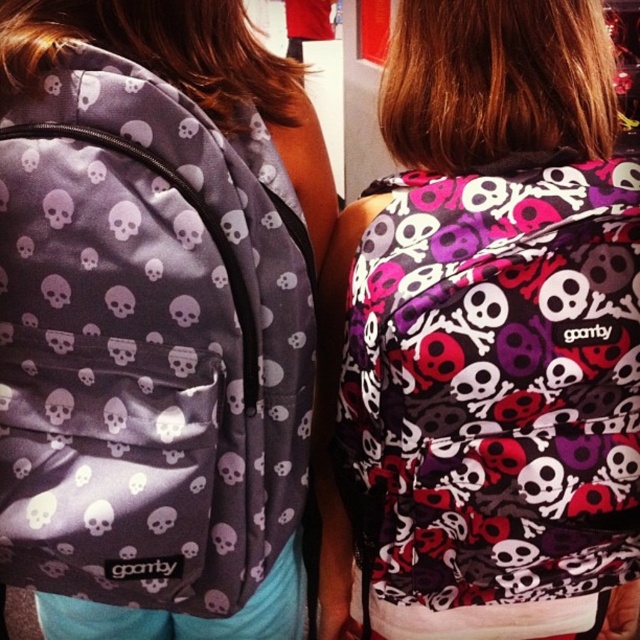
Can you confirm if matte purple backpack at center is shorter than matte purple skull-patterned backpack at upper left?

Incorrect, matte purple backpack at center's height does not fall short of matte purple skull-patterned backpack at upper left's.

This screenshot has height=640, width=640. What do you see at coordinates (484, 340) in the screenshot? I see `matte purple backpack at center` at bounding box center [484, 340].

The width and height of the screenshot is (640, 640). I want to click on matte purple backpack at center, so click(484, 340).